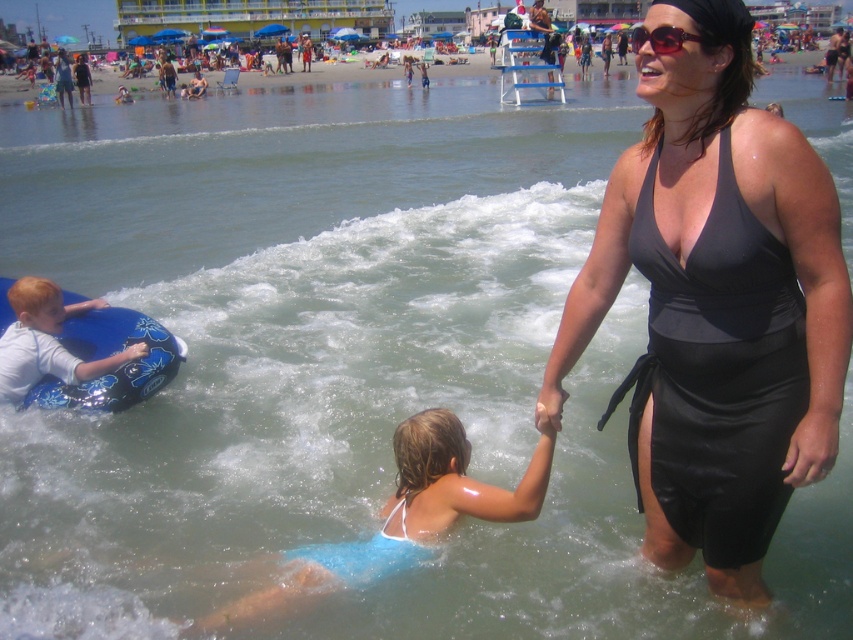
You are a photographer trying to capture a candid shot of the two figures in the water. You notice the matte black swimsuit at center and the light blue fabric swimsuit at lower center. Which swimmer might be easier to see against the dark ocean water, and why?

The light blue fabric swimsuit at lower center would be easier to see against the dark ocean water because it has a lighter color contrast compared to the matte black swimsuit at center, which blends in more with the dark water.

You are a photographer taking a picture of the matte black swimsuit at center and the light blue fabric swimsuit at lower center. Which one will appear larger in the photo?

The matte black swimsuit at center will appear larger in the photo because it is closer to the viewer than the light blue fabric swimsuit at lower center.